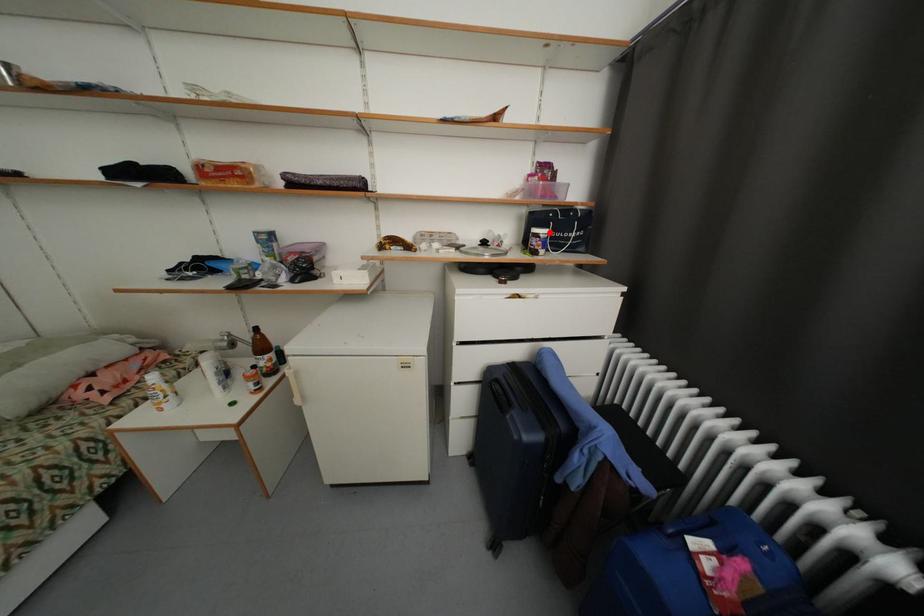
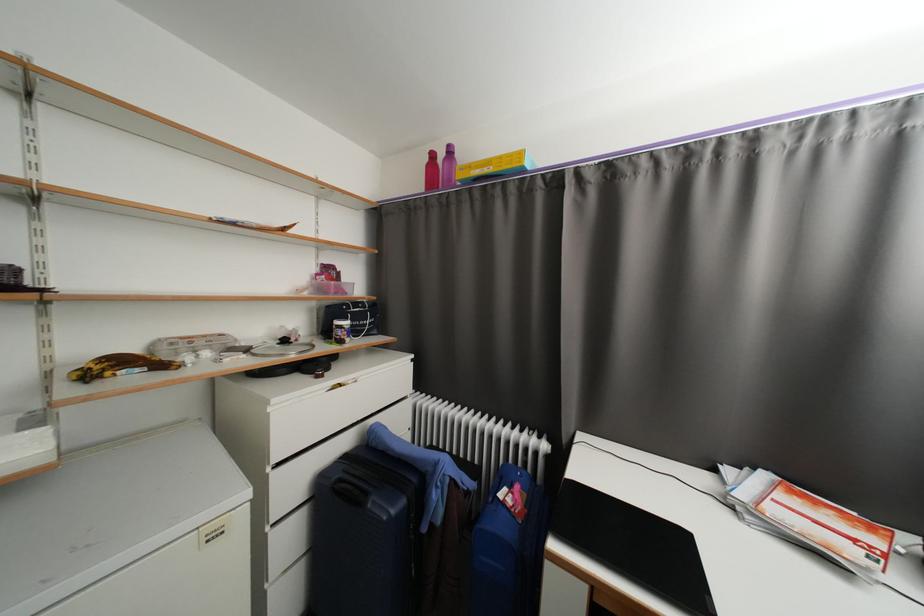
Find the pixel in the second image that matches the highlighted location in the first image.

(353, 323)